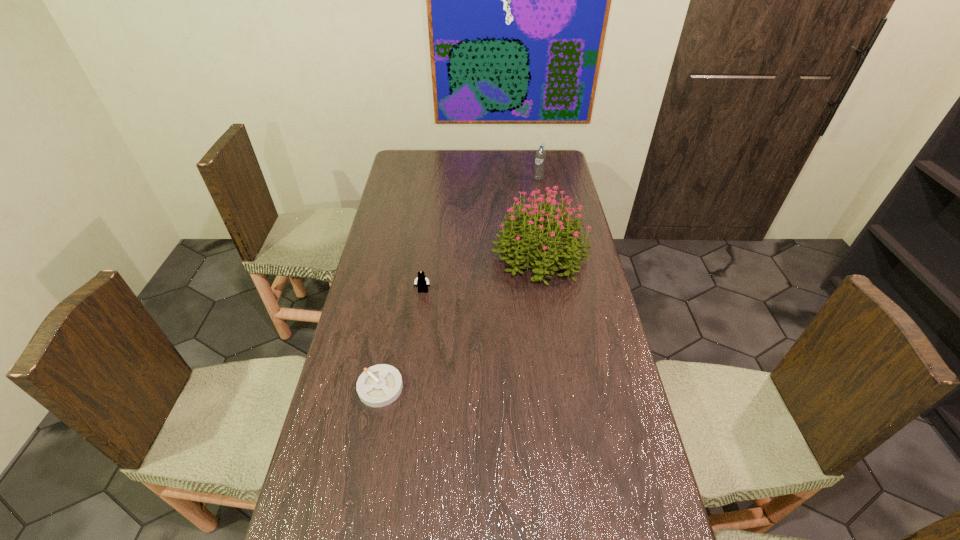
In order to click on object situated at the left edge in this screenshot , I will do `click(379, 385)`.

This screenshot has width=960, height=540. Identify the location of bouquet positioned at the right edge. (542, 228).

At what (x,y) coordinates should I click in order to perform the action: click on water bottle positioned at the right edge. Please return your answer as a coordinate pair (x, y). Looking at the image, I should click on (540, 156).

Where is `vacant space at the far edge of the desktop`? The height and width of the screenshot is (540, 960). vacant space at the far edge of the desktop is located at coordinates (454, 169).

What are the coordinates of `free spot at the left edge of the desktop` in the screenshot? It's located at (396, 188).

The image size is (960, 540). Identify the location of vacant space at the right edge of the desktop. (588, 413).

Locate an element on the screen. This screenshot has width=960, height=540. blank space at the far left corner is located at coordinates (427, 160).

The image size is (960, 540). Identify the location of free space that is in between the water bottle and the nearest object. (459, 283).

Locate an element on the screen. The height and width of the screenshot is (540, 960). free spot between the third tallest object and the third shortest object is located at coordinates (481, 235).

At what (x,y) coordinates should I click in order to perform the action: click on free space between the shortest object and the Lego. Please return your answer as a coordinate pair (x, y). This screenshot has width=960, height=540. Looking at the image, I should click on (401, 340).